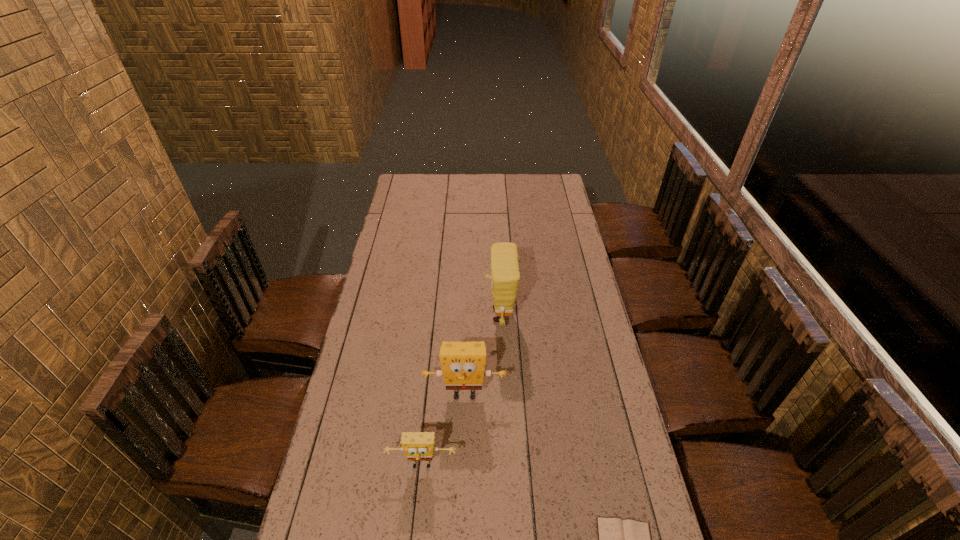
Image resolution: width=960 pixels, height=540 pixels. I want to click on the tallest sponge, so click(x=505, y=275).

Where is `the farthest object`? Image resolution: width=960 pixels, height=540 pixels. the farthest object is located at coordinates (505, 275).

Locate an element on the screen. the second tallest sponge is located at coordinates (463, 363).

Where is `the second nearest sponge`? The image size is (960, 540). the second nearest sponge is located at coordinates (463, 363).

At what (x,y) coordinates should I click in order to perform the action: click on the nearest sponge. Please return your answer as a coordinate pair (x, y). Looking at the image, I should click on (418, 446).

You are a GUI agent. You are given a task and a screenshot of the screen. Output one action in this format:
    pyautogui.click(x=<x>, y=<y>)
    Task: Click on the third tallest object
    The width and height of the screenshot is (960, 540).
    Given the screenshot: What is the action you would take?
    pyautogui.click(x=418, y=446)

Find the location of a particular element. The image size is (960, 540). vacant space positioned on the face of the tallest object is located at coordinates (404, 315).

Locate an element on the screen. The image size is (960, 540). vacant area located on the face of the tallest object is located at coordinates pos(420,315).

Where is `free space located 0.130m on the face of the tallest object`? free space located 0.130m on the face of the tallest object is located at coordinates (451, 315).

Find the location of a particular element. free space located 0.060m on the face of the second shortest sponge is located at coordinates (464, 427).